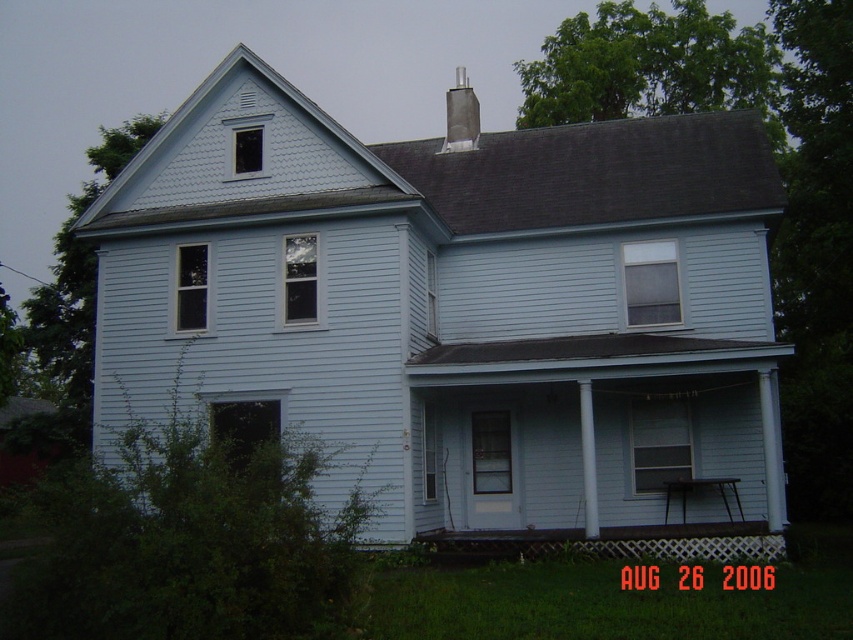
Question: Does white wood siding at center appear under dark gray concrete chimney at upper center?

Choices:
 (A) yes
 (B) no

Answer: (A)

Question: Estimate the real-world distances between objects in this image. Which object is farther from the white lattice porch at lower center?

Choices:
 (A) white wood siding at center
 (B) dark gray concrete chimney at upper center

Answer: (B)

Question: Which of the following is the closest to the observer?

Choices:
 (A) white lattice porch at lower center
 (B) dark gray concrete chimney at upper center

Answer: (A)

Question: Where is white wood siding at center located in relation to dark gray concrete chimney at upper center in the image?

Choices:
 (A) right
 (B) left

Answer: (A)

Question: Is white lattice porch at lower center thinner than dark gray concrete chimney at upper center?

Choices:
 (A) no
 (B) yes

Answer: (B)

Question: Which object is closer to the camera taking this photo?

Choices:
 (A) white wood siding at center
 (B) dark gray concrete chimney at upper center

Answer: (A)